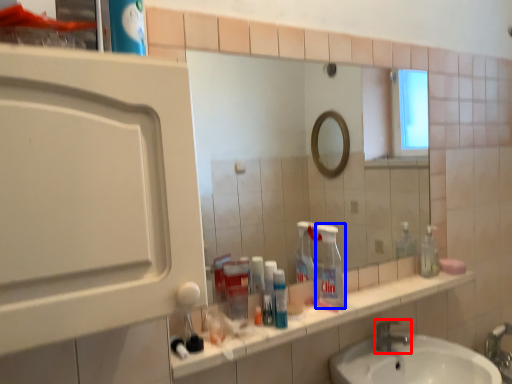
Question: Among these objects, which one is nearest to the camera, tap (highlighted by a red box) or cleaning product (highlighted by a blue box)?

Choices:
 (A) tap
 (B) cleaning product

Answer: (B)